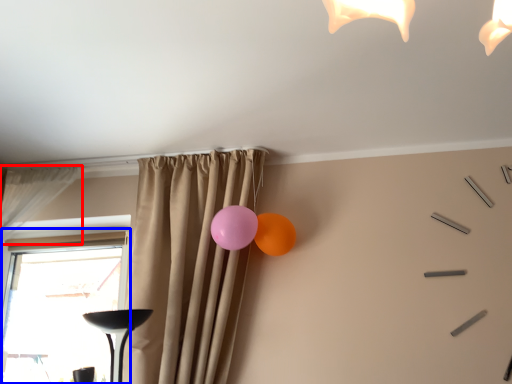
Question: Which of the following is the farthest to the observer, curtain (highlighted by a red box) or window (highlighted by a blue box)?

Choices:
 (A) curtain
 (B) window

Answer: (B)